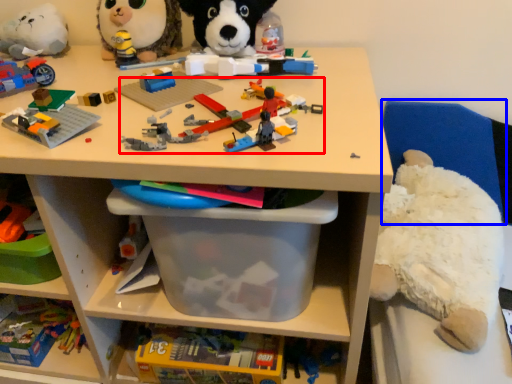
Question: Which object is closer to the camera taking this photo, toy (highlighted by a red box) or chair (highlighted by a blue box)?

Choices:
 (A) toy
 (B) chair

Answer: (A)